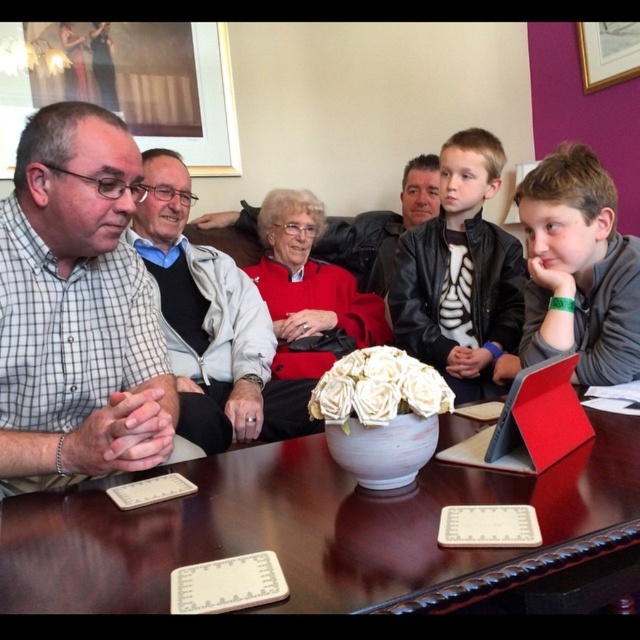
Who is shorter, checkered fabric shirt at left or gray matte shirt at right?

gray matte shirt at right

Is checkered fabric shirt at left taller than gray matte shirt at right?

Indeed, checkered fabric shirt at left has a greater height compared to gray matte shirt at right.

Which is behind, point (157, 397) or point (602, 333)?

Point (602, 333)

I want to click on checkered fabric shirt at left, so click(77, 308).

Who is shorter, matte black laptop at center or matte black jacket at center?

Standing shorter between the two is matte black laptop at center.

Between matte black laptop at center and matte black jacket at center, which one appears on the right side from the viewer's perspective?

matte black jacket at center is more to the right.

Does point (42, 380) come behind point (388, 310)?

No.

Find the location of a particular element. This screenshot has width=640, height=640. matte black laptop at center is located at coordinates (77, 308).

Is matte black laptop at center to the right of gray matte shirt at right from the viewer's perspective?

In fact, matte black laptop at center is to the left of gray matte shirt at right.

Is point (74, 257) positioned after point (637, 262)?

No, (74, 257) is in front of (637, 262).

Who is more distant from viewer, [38,344] or [605,364]?

The point [605,364] is behind.

This screenshot has height=640, width=640. I want to click on matte black laptop at center, so click(x=77, y=308).